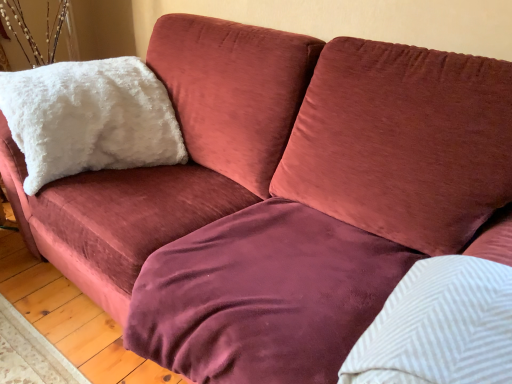
The width and height of the screenshot is (512, 384). Describe the element at coordinates (89, 118) in the screenshot. I see `white fluffy pillow at upper left, the 2th pillow from the right` at that location.

The width and height of the screenshot is (512, 384). I want to click on velvet maroon blanket at center, so click(263, 296).

Is white textured pillow at upper right, which is the first pillow in bottom-to-top order, directly adjacent to white fluffy pillow at upper left, arranged as the 1th pillow when viewed from the left?

No.

Consider the image. From the image's perspective, would you say white textured pillow at upper right, the 1th pillow from the front, is positioned over white fluffy pillow at upper left, the 2th pillow from the right?

No, from the image's perspective, white textured pillow at upper right, the 1th pillow from the front, is not over white fluffy pillow at upper left, the 2th pillow from the right.

Is white textured pillow at upper right, positioned as the first pillow in right-to-left order, aimed at white fluffy pillow at upper left, which is counted as the second pillow, starting from the front?

No, white textured pillow at upper right, positioned as the first pillow in right-to-left order, is not facing towards white fluffy pillow at upper left, which is counted as the second pillow, starting from the front.

Does white fluffy pillow at upper left, which appears as the 1th pillow when viewed from the back, appear on the left side of velvet maroon blanket at center?

Yes, white fluffy pillow at upper left, which appears as the 1th pillow when viewed from the back, is to the left of velvet maroon blanket at center.

From the picture: From the image's perspective, which one is positioned higher, white fluffy pillow at upper left, the 2th pillow from the right, or velvet maroon blanket at center?

white fluffy pillow at upper left, the 2th pillow from the right.

Is white fluffy pillow at upper left, which is the first pillow in top-to-bottom order, inside the boundaries of velvet maroon blanket at center, or outside?

white fluffy pillow at upper left, which is the first pillow in top-to-bottom order, is not inside velvet maroon blanket at center, it's outside.

Looking at this image, between velvet maroon blanket at center and white fluffy pillow at upper left, which is counted as the second pillow, starting from the front, which one has more height?

With more height is white fluffy pillow at upper left, which is counted as the second pillow, starting from the front.

Are velvet maroon blanket at center and white fluffy pillow at upper left, positioned as the second pillow in bottom-to-top order, beside each other?

There is a gap between velvet maroon blanket at center and white fluffy pillow at upper left, positioned as the second pillow in bottom-to-top order.

Relative to white fluffy pillow at upper left, which appears as the 1th pillow when viewed from the back, is velvet maroon blanket at center in front or behind?

In the image, velvet maroon blanket at center appears in front of white fluffy pillow at upper left, which appears as the 1th pillow when viewed from the back.

Which of these two, velvet maroon blanket at center or white fluffy pillow at upper left, positioned as the second pillow in bottom-to-top order, is wider?

With larger width is velvet maroon blanket at center.

From a real-world perspective, is white fluffy pillow at upper left, which is counted as the second pillow, starting from the front, positioned above or below white textured pillow at upper right, the second pillow when ordered from left to right?

From a real-world perspective, white fluffy pillow at upper left, which is counted as the second pillow, starting from the front, is physically above white textured pillow at upper right, the second pillow when ordered from left to right.

Could you measure the distance between white fluffy pillow at upper left, positioned as the second pillow in bottom-to-top order, and white textured pillow at upper right, the second pillow when ordered from left to right?

They are 4.03 feet apart.

From the image's perspective, between white fluffy pillow at upper left, the 2th pillow from the right, and white textured pillow at upper right, positioned as the first pillow in right-to-left order, who is located below?

white textured pillow at upper right, positioned as the first pillow in right-to-left order, is shown below in the image.

Would you consider white fluffy pillow at upper left, positioned as the second pillow in bottom-to-top order, to be distant from white textured pillow at upper right, which is the second pillow from top to bottom?

white fluffy pillow at upper left, positioned as the second pillow in bottom-to-top order, is far away from white textured pillow at upper right, which is the second pillow from top to bottom.

From the image's perspective, is white textured pillow at upper right, which is the second pillow from top to bottom, below velvet maroon blanket at center?

Correct, white textured pillow at upper right, which is the second pillow from top to bottom, appears lower than velvet maroon blanket at center in the image.

From a real-world perspective, who is located lower, white textured pillow at upper right, arranged as the second pillow when viewed from the back, or velvet maroon blanket at center?

velvet maroon blanket at center is physically lower.

From the picture: Is there a large distance between white textured pillow at upper right, which is the first pillow in bottom-to-top order, and velvet maroon blanket at center?

No, there isn't a large distance between white textured pillow at upper right, which is the first pillow in bottom-to-top order, and velvet maroon blanket at center.

Between velvet maroon blanket at center and white textured pillow at upper right, which is the first pillow in bottom-to-top order, which one has more height?

velvet maroon blanket at center is taller.

Does velvet maroon blanket at center have a smaller size compared to white textured pillow at upper right, which is the second pillow from top to bottom?

Actually, velvet maroon blanket at center might be larger than white textured pillow at upper right, which is the second pillow from top to bottom.

Identify the location of pillow located on the right of white fluffy pillow at upper left, which is counted as the second pillow, starting from the front. (439, 327).

The width and height of the screenshot is (512, 384). Find the location of `bedding in front of the white fluffy pillow at upper left, the 2th pillow from the right`. bedding in front of the white fluffy pillow at upper left, the 2th pillow from the right is located at coordinates (263, 296).

In the scene shown: Which object lies nearer to the anchor point white fluffy pillow at upper left, arranged as the 1th pillow when viewed from the left, white textured pillow at upper right, which is the second pillow from top to bottom, or velvet maroon blanket at center?

velvet maroon blanket at center is positioned closer to the anchor white fluffy pillow at upper left, arranged as the 1th pillow when viewed from the left.

Looking at the image, which one is located further to white textured pillow at upper right, which is the second pillow from top to bottom, white fluffy pillow at upper left, which appears as the 1th pillow when viewed from the back, or velvet maroon blanket at center?

white fluffy pillow at upper left, which appears as the 1th pillow when viewed from the back, lies further to white textured pillow at upper right, which is the second pillow from top to bottom, than the other object.

Looking at the image, which one is located further to white textured pillow at upper right, positioned as the first pillow in right-to-left order, velvet maroon blanket at center or white fluffy pillow at upper left, positioned as the second pillow in bottom-to-top order?

The object further to white textured pillow at upper right, positioned as the first pillow in right-to-left order, is white fluffy pillow at upper left, positioned as the second pillow in bottom-to-top order.

Considering their positions, is white textured pillow at upper right, the second pillow when ordered from left to right, positioned closer to velvet maroon blanket at center than white fluffy pillow at upper left, arranged as the 1th pillow when viewed from the left?

Based on the image, white textured pillow at upper right, the second pillow when ordered from left to right, appears to be nearer to velvet maroon blanket at center.

Based on their spatial positions, is velvet maroon blanket at center or white textured pillow at upper right, arranged as the second pillow when viewed from the back, closer to white fluffy pillow at upper left, which is counted as the second pillow, starting from the front?

velvet maroon blanket at center is positioned closer to the anchor white fluffy pillow at upper left, which is counted as the second pillow, starting from the front.

Based on the photo, considering their positions, is white fluffy pillow at upper left, arranged as the 1th pillow when viewed from the left, positioned closer to velvet maroon blanket at center than white textured pillow at upper right, positioned as the first pillow in right-to-left order?

Among the two, white textured pillow at upper right, positioned as the first pillow in right-to-left order, is located nearer to velvet maroon blanket at center.

Identify the location of bedding between white fluffy pillow at upper left, which is counted as the second pillow, starting from the front, and white textured pillow at upper right, which is the second pillow from top to bottom, in the horizontal direction. The width and height of the screenshot is (512, 384). (263, 296).